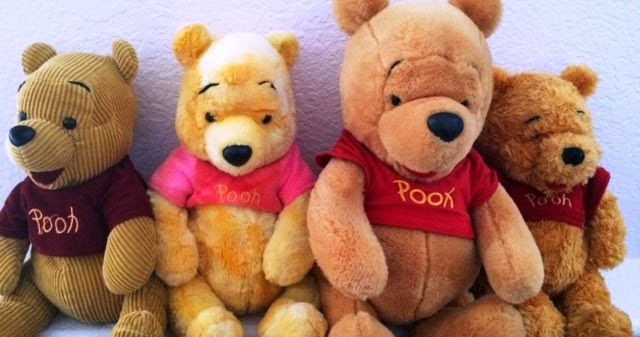
Where is `teddy bears`? The image size is (640, 337). teddy bears is located at coordinates (120, 187), (209, 175), (381, 178), (540, 190).